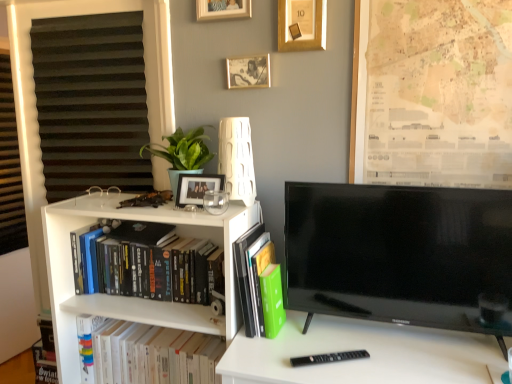
This screenshot has width=512, height=384. In order to click on free spot in front of black glossy tv at right in this screenshot , I will do `click(408, 364)`.